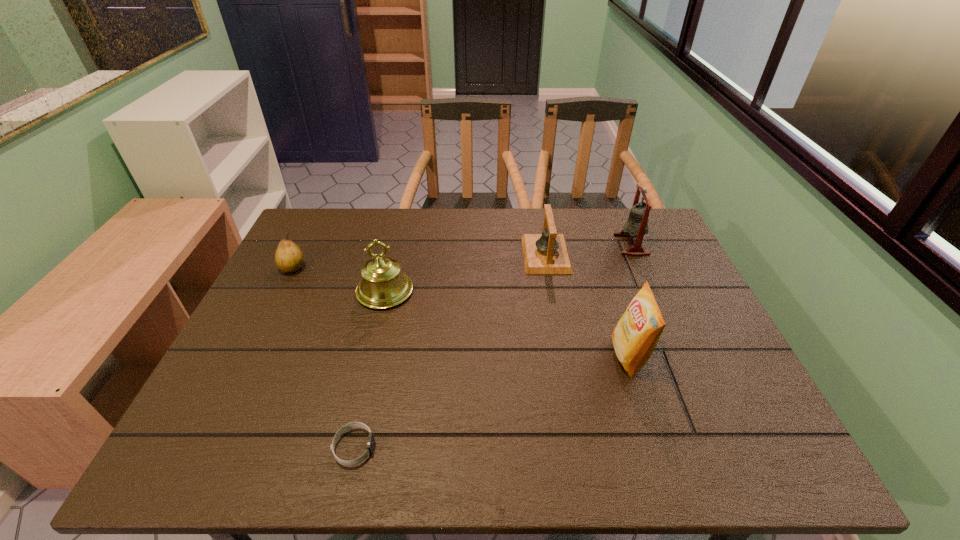
At what (x,y) coordinates should I click in order to perform the action: click on vacant space located on the front of the rightmost object. Please return your answer as a coordinate pair (x, y). The image size is (960, 540). Looking at the image, I should click on [641, 268].

Image resolution: width=960 pixels, height=540 pixels. Find the location of `free space located 0.400m on the front-facing side of the second nearest object`. free space located 0.400m on the front-facing side of the second nearest object is located at coordinates pos(444,356).

The image size is (960, 540). I want to click on vacant area located 0.230m on the front-facing side of the second nearest object, so click(516, 356).

You are a GUI agent. You are given a task and a screenshot of the screen. Output one action in this format:
    pyautogui.click(x=<x>, y=<y>)
    Task: Click on the vacant space located 0.200m on the front-facing side of the second nearest object
    Image resolution: width=960 pixels, height=540 pixels.
    Given the screenshot: What is the action you would take?
    pyautogui.click(x=528, y=356)

Where is `free space located on the back of the leftmost bell`? This screenshot has height=540, width=960. free space located on the back of the leftmost bell is located at coordinates (392, 262).

Locate an element on the screen. vacant area situated on the front of the fourth object from left to right is located at coordinates (560, 328).

What are the coordinates of `vacant space located on the right of the second shortest object` in the screenshot? It's located at (392, 267).

What are the coordinates of `vacant area located on the outer surface of the nearest object` in the screenshot? It's located at (469, 447).

The width and height of the screenshot is (960, 540). What are the coordinates of `object located in the near edge section of the desktop` in the screenshot? It's located at (370, 444).

What are the coordinates of `object present at the left edge` in the screenshot? It's located at (289, 258).